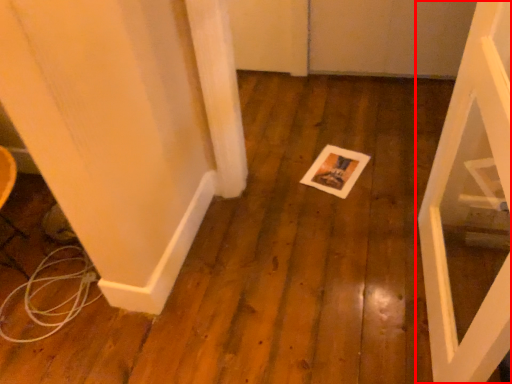
Question: From the image's perspective, where is door (annotated by the red box) located relative to postcard?

Choices:
 (A) above
 (B) below

Answer: (B)